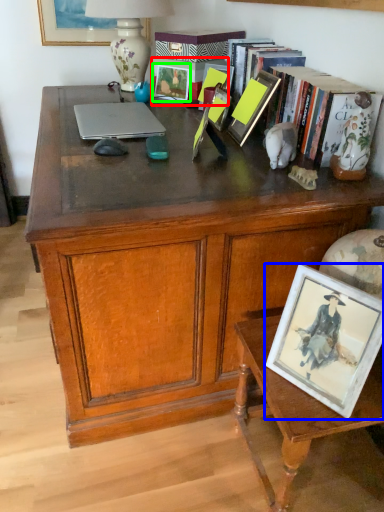
Question: Estimate the real-world distances between objects in this image. Which object is closer to picture frame (highlighted by a red box), picture frame (highlighted by a blue box) or picture frame (highlighted by a green box)?

Choices:
 (A) picture frame
 (B) picture frame

Answer: (B)